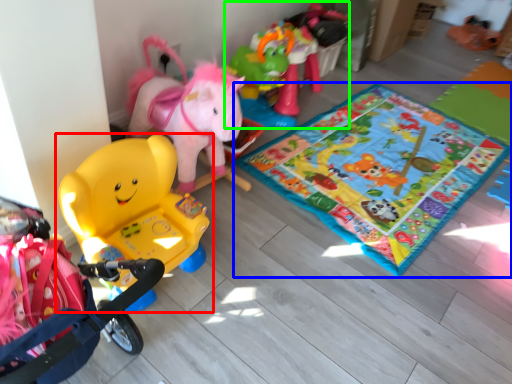
Question: Based on their relative distances, which object is farther from toy (highlighted by a red box)? Choose from yoga mat (highlighted by a blue box) and toy (highlighted by a green box).

Choices:
 (A) yoga mat
 (B) toy

Answer: (B)